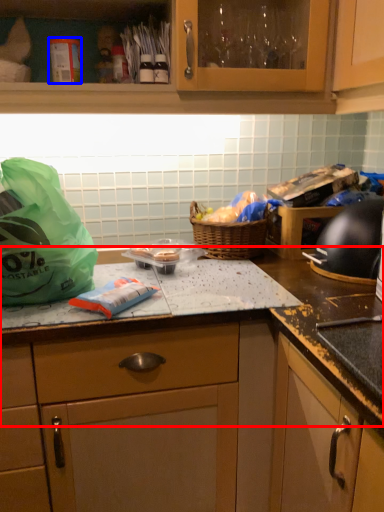
Question: Which object is further to the camera taking this photo, countertop (highlighted by a red box) or kitchen appliance (highlighted by a blue box)?

Choices:
 (A) countertop
 (B) kitchen appliance

Answer: (B)